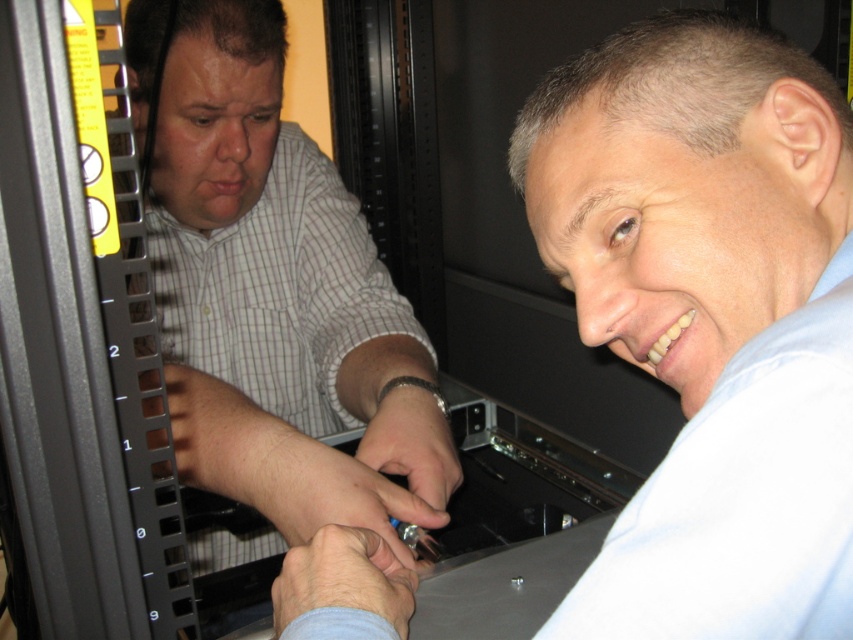
Question: Can you confirm if light blue shirt at center is positioned below white checkered shirt at left?

Choices:
 (A) no
 (B) yes

Answer: (B)

Question: Does light blue shirt at center appear on the left side of white checkered shirt at left?

Choices:
 (A) no
 (B) yes

Answer: (A)

Question: Does light blue shirt at center have a greater width compared to white checkered shirt at left?

Choices:
 (A) no
 (B) yes

Answer: (A)

Question: Which of the following is the closest to the observer?

Choices:
 (A) (646, 28)
 (B) (233, 234)

Answer: (A)

Question: Which object is farther from the camera taking this photo?

Choices:
 (A) light blue shirt at center
 (B) white checkered shirt at left

Answer: (B)